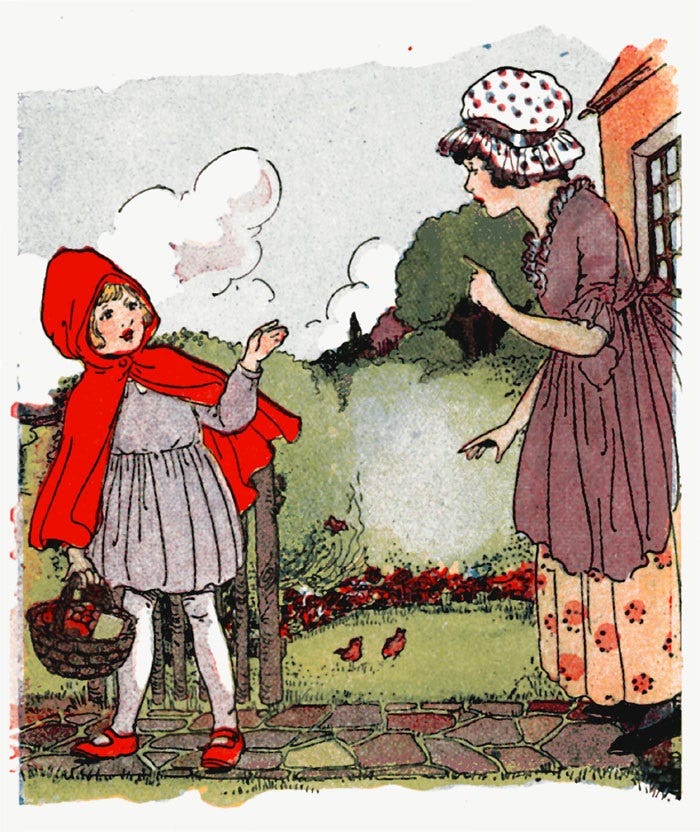
The height and width of the screenshot is (832, 700). I want to click on window, so click(x=666, y=240).